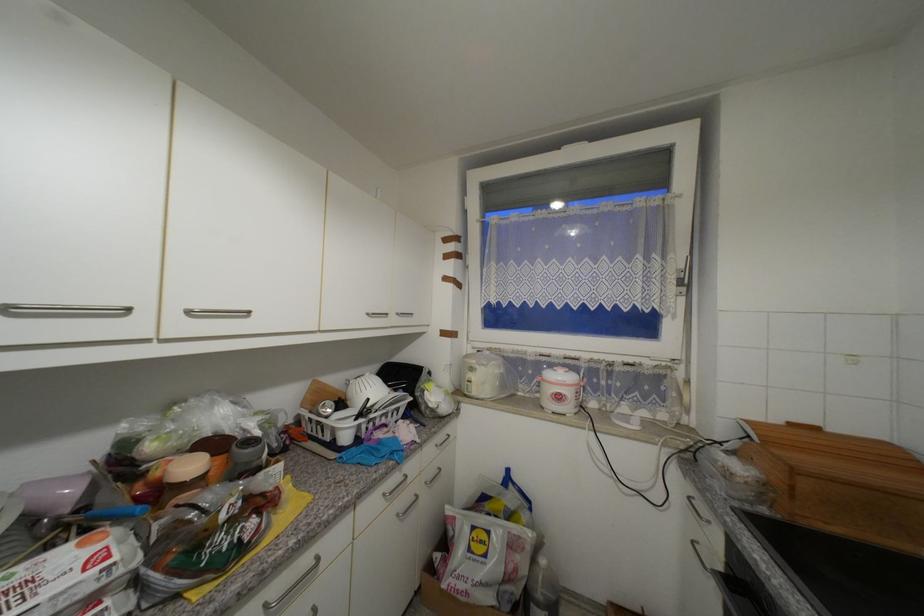
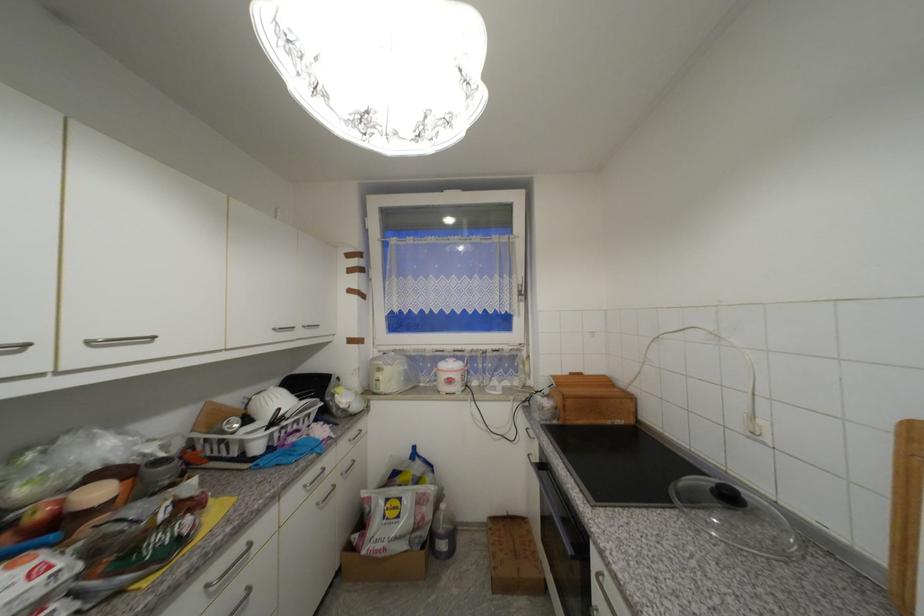
Find the pixel in the second image that matches [441,435] in the first image.

(354, 430)